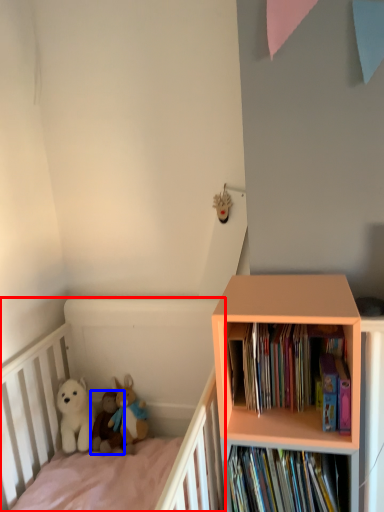
Question: Which object is closer to the camera taking this photo, infant bed (highlighted by a red box) or toy (highlighted by a blue box)?

Choices:
 (A) infant bed
 (B) toy

Answer: (A)